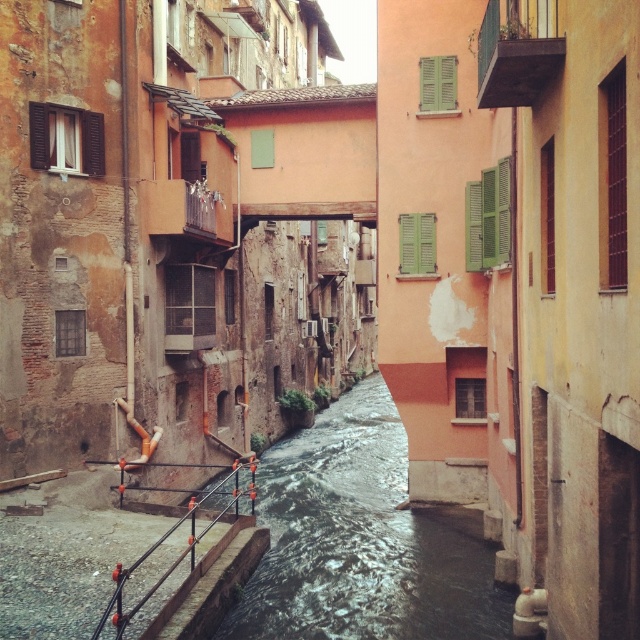
Question: Is black metal railing at lower center closer to camera compared to brown wooden shutter at right?

Choices:
 (A) yes
 (B) no

Answer: (B)

Question: In this image, where is green matte shutter at upper center located relative to green wooden shutters at upper center?

Choices:
 (A) below
 (B) above

Answer: (A)

Question: Does green matte shutters at upper center come in front of green matte shutter at upper center?

Choices:
 (A) no
 (B) yes

Answer: (B)

Question: Which of these objects is positioned farthest from the green matte shutters at upper center?

Choices:
 (A) black metal railing at lower center
 (B) green wooden shutters at upper center

Answer: (A)

Question: Which of the following is the farthest from the observer?

Choices:
 (A) (433, 224)
 (B) (476, 237)
 (C) (611, 132)

Answer: (A)

Question: Which is nearer to the green matte shutters at upper center?

Choices:
 (A) black metal railing at lower center
 (B) green wooden shutters at upper center
 (C) brown wooden shutter at right

Answer: (B)